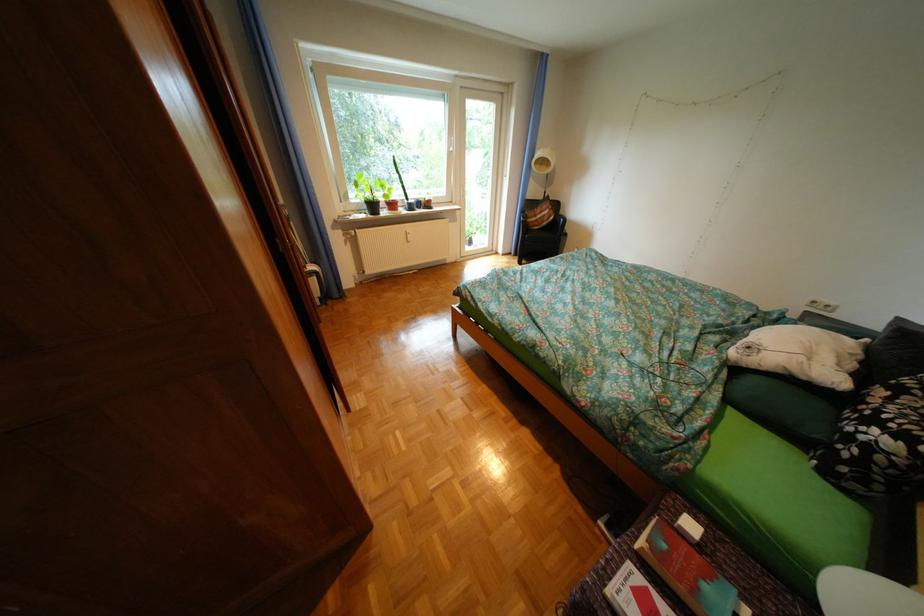
Locate an element on the screen. The height and width of the screenshot is (616, 924). red book is located at coordinates (687, 572).